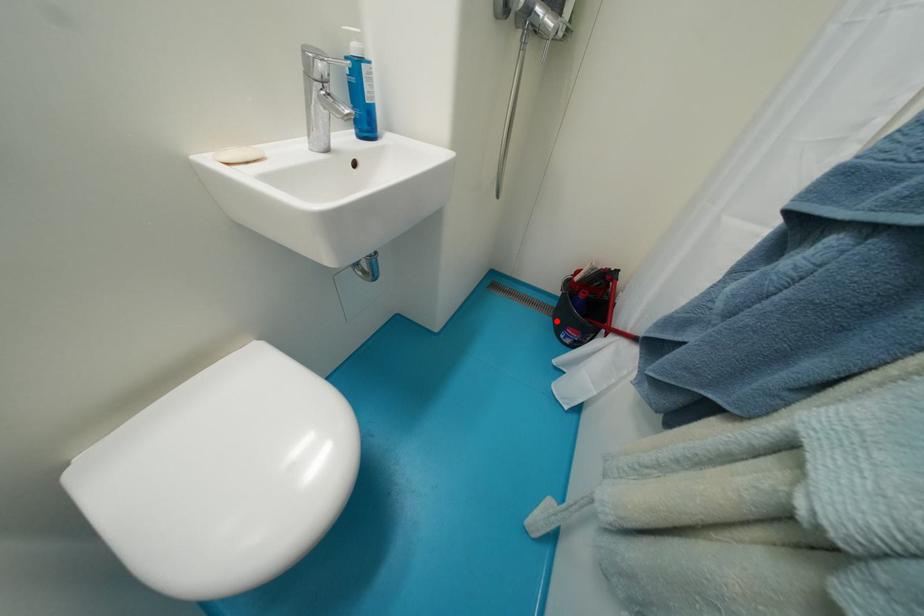
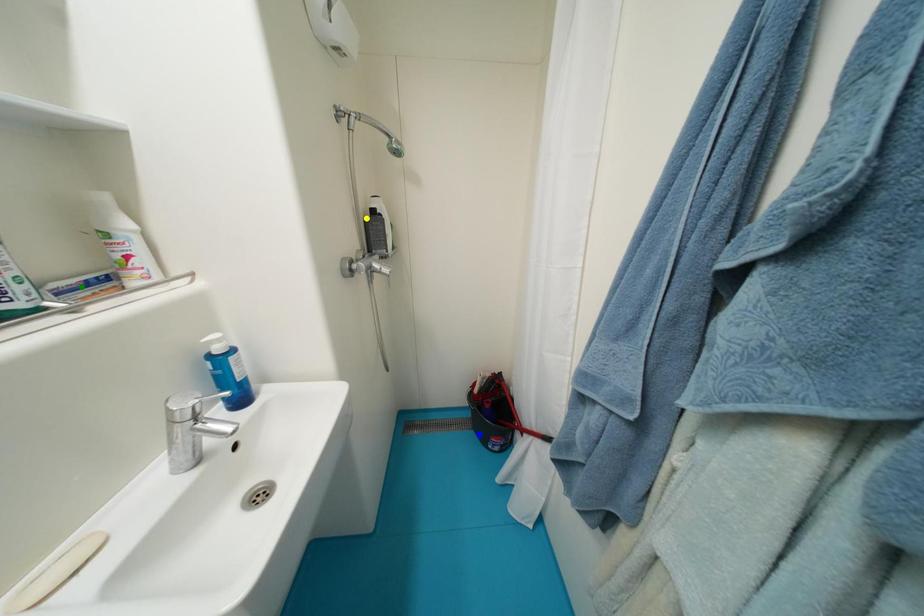
Question: I am providing you with two images of the same scene from different viewpoints. A red point is marked on the first image. You are given multiple points on the second image. Which point in image 2 represents the same 3d spot as the red point in image 1?

Choices:
 (A) yellow point
 (B) blue point
 (C) green point

Answer: (B)